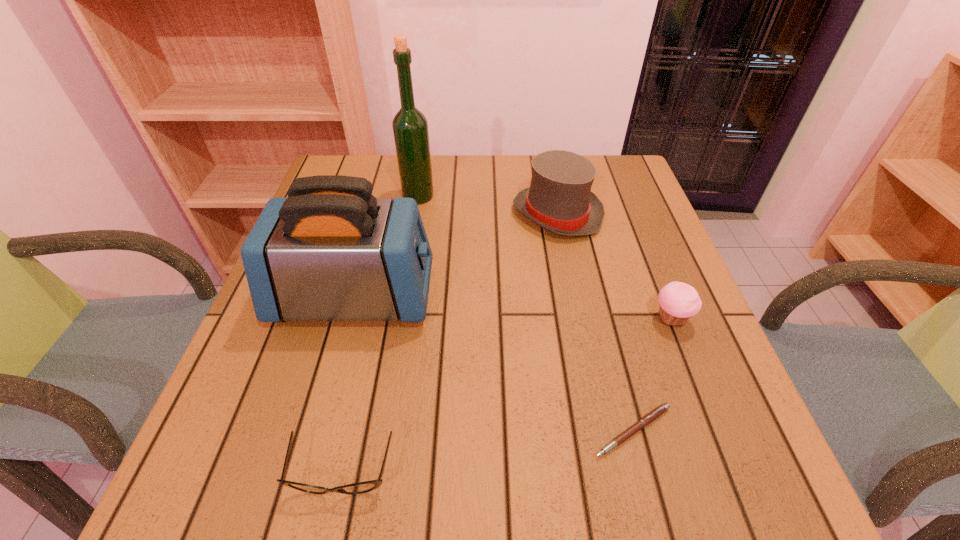
Identify the location of object that is at the near left corner. [362, 487].

Where is `object that is positioned at the far right corner`? object that is positioned at the far right corner is located at coordinates (559, 199).

Image resolution: width=960 pixels, height=540 pixels. I want to click on object at the near right corner, so click(x=654, y=414).

Where is `vacant space at the far edge`? The height and width of the screenshot is (540, 960). vacant space at the far edge is located at coordinates (468, 190).

Identify the location of vacant space at the near edge of the desktop. (605, 487).

This screenshot has width=960, height=540. I want to click on free location at the right edge, so click(x=716, y=380).

This screenshot has width=960, height=540. I want to click on free point at the far left corner, so click(x=346, y=161).

In the image, there is a desktop. Identify the location of blank space at the far right corner. (593, 154).

Where is `free space between the third tallest object and the rightmost object`? free space between the third tallest object and the rightmost object is located at coordinates (613, 266).

You are a GUI agent. You are given a task and a screenshot of the screen. Output one action in this format:
    pyautogui.click(x=<x>, y=<y>)
    Task: Click on the vacant space that is in between the fourth tallest object and the dress hat
    
    Given the screenshot: What is the action you would take?
    pyautogui.click(x=613, y=266)